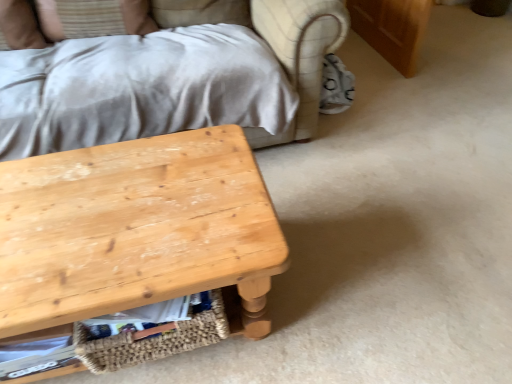
The image size is (512, 384). Identify the location of spots to the right of natural wood table at lower left. (346, 269).